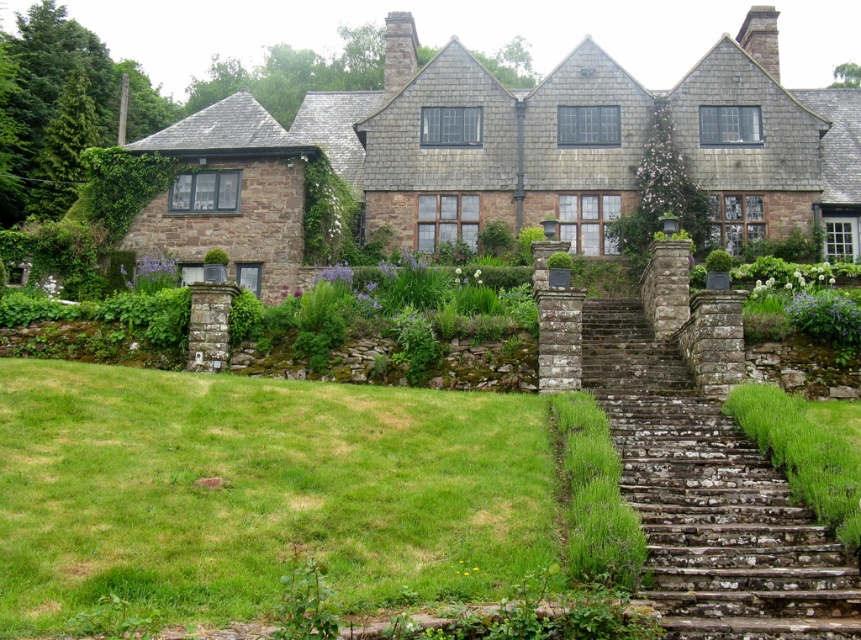
You are a gardener who wants to plant a new flower bed. You have two areas to choose from in the scene. Which area has more space available for planting? The green grass at lower left or the green mossy stone steps at lower right?

The green grass at lower left has more space available for planting since it is bigger than the green mossy stone steps at lower right.

You are standing in the garden of the stone house and want to walk from the green grass at lower left to the rusty stone stairs at right. Which area will feel more stable under your feet?

The rusty stone stairs at right will feel more stable under your feet because they are made of stone, while the green grass at lower left is softer and less firm.